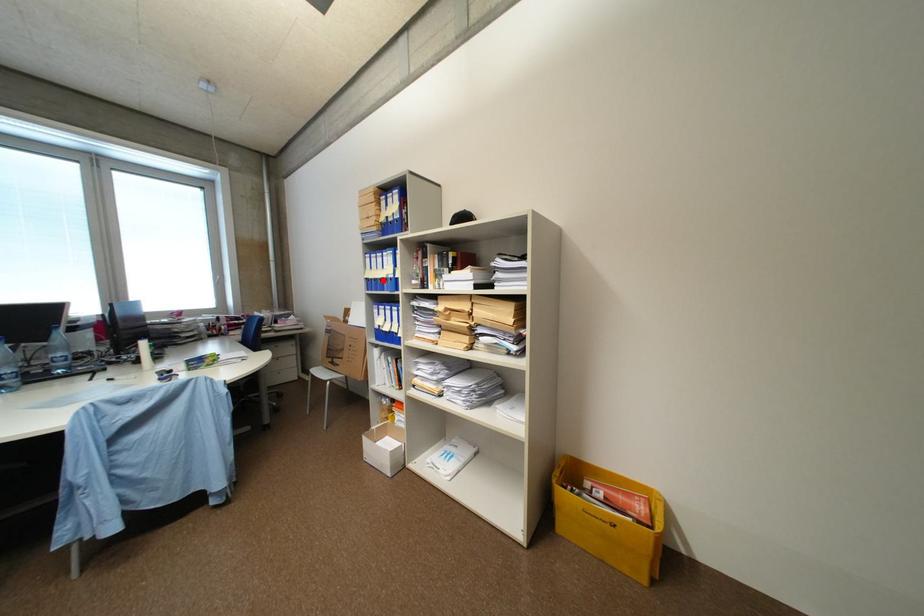
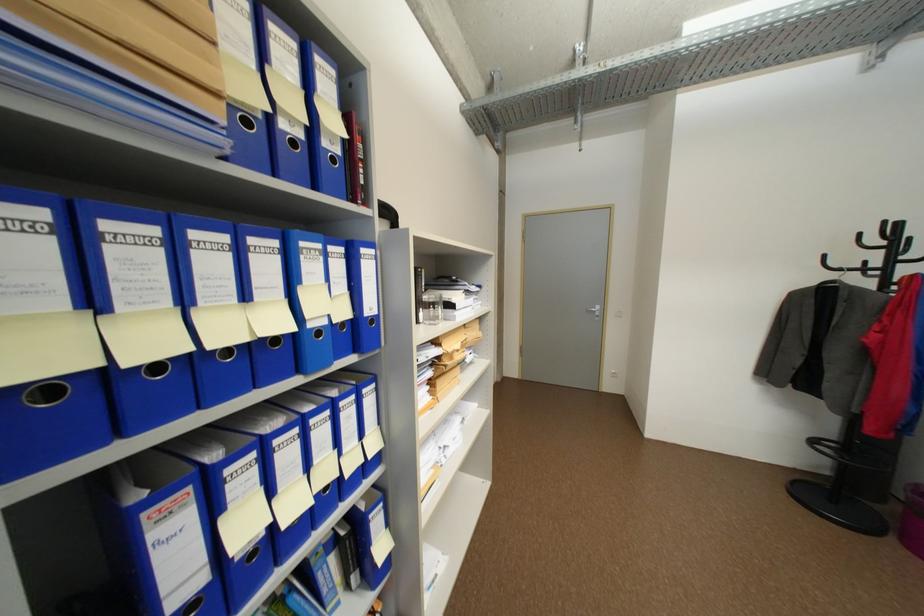
Find the pixel in the second image that matches the highlighted location in the first image.

(164, 368)